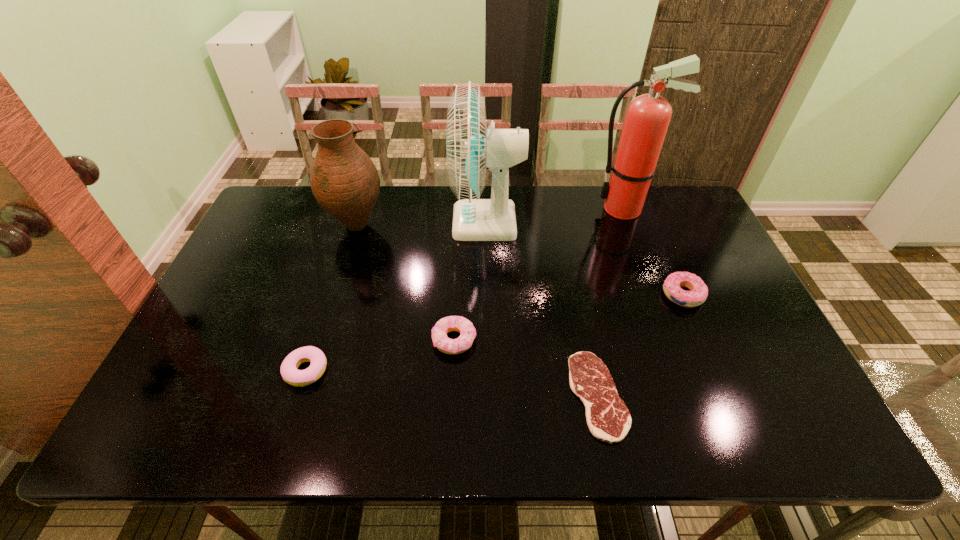
Locate an element on the screen. fire extinguisher is located at coordinates (647, 118).

Locate an element on the screen. The width and height of the screenshot is (960, 540). fan is located at coordinates (470, 147).

Identify the location of the fifth shortest object. (344, 180).

The image size is (960, 540). What are the coordinates of `the rightmost doughnut` in the screenshot? It's located at (698, 293).

Find the location of a particular element. the farthest doughnut is located at coordinates (698, 293).

You are a GUI agent. You are given a task and a screenshot of the screen. Output one action in this format:
    pyautogui.click(x=<x>, y=<y>)
    Task: Click on the second doughnut from right to left
    
    Given the screenshot: What is the action you would take?
    pyautogui.click(x=467, y=331)

Identify the location of the leftmost doughnut. (289, 370).

Find the location of `the shortest object`. the shortest object is located at coordinates tap(608, 419).

In order to click on the fifth object from left to right in this screenshot , I will do `click(608, 419)`.

Find the location of a particular element. The image size is (960, 540). free space located on the hose direction of the fire extinguisher is located at coordinates (483, 209).